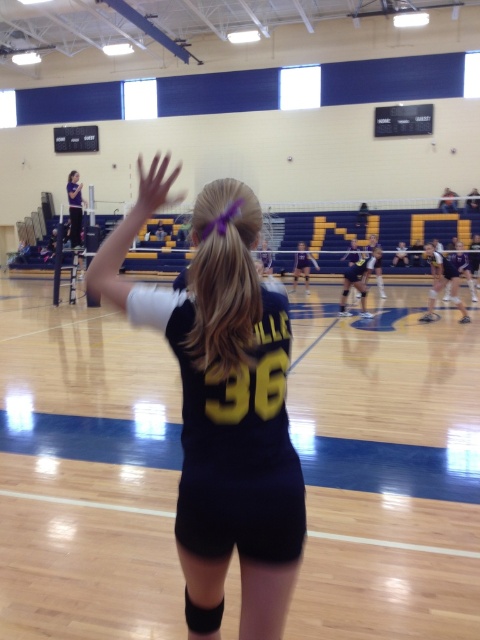
Who is positioned more to the left, black uniform at center or purple jersey at upper left?

purple jersey at upper left

Which is more to the right, black uniform at center or purple jersey at upper left?

black uniform at center

Is point (427, 243) positioned before point (68, 180)?

No, (427, 243) is further to viewer.

This screenshot has height=640, width=480. I want to click on black uniform at center, so click(x=442, y=282).

Which of these two, black jersey at center or black uniform at center, stands shorter?

black uniform at center

Between black jersey at center and black uniform at center, which one is positioned lower?

black jersey at center

The height and width of the screenshot is (640, 480). I want to click on black jersey at center, so click(235, 410).

In order to click on black jersey at center in this screenshot , I will do `click(235, 410)`.

Does point (72, 211) come farther from viewer compared to point (304, 291)?

No, it is not.

Who is positioned more to the left, purple jersey at upper left or matte black uniform at center?

purple jersey at upper left

In order to click on purple jersey at upper left in this screenshot , I will do `click(74, 208)`.

The image size is (480, 640). In order to click on purple jersey at upper left in this screenshot , I will do `click(74, 208)`.